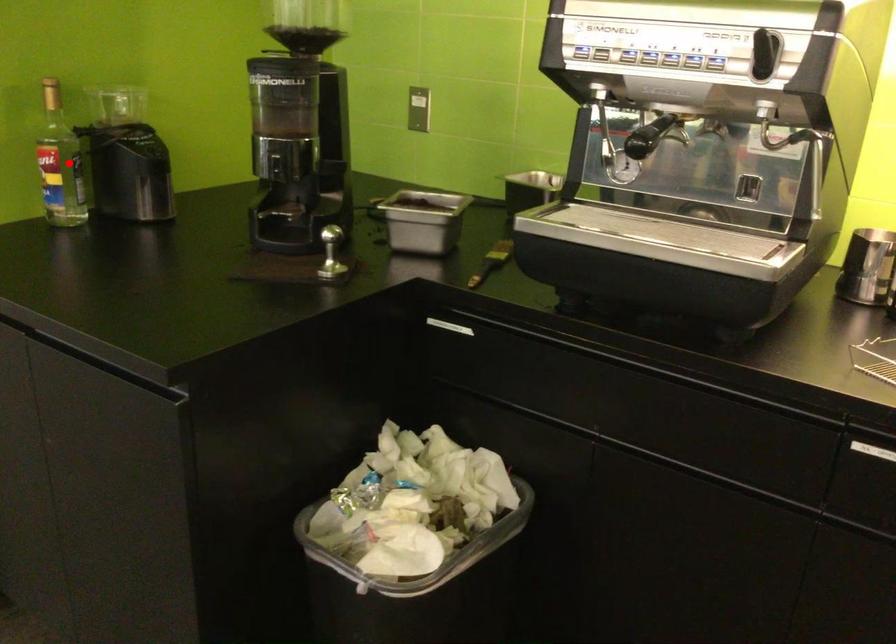
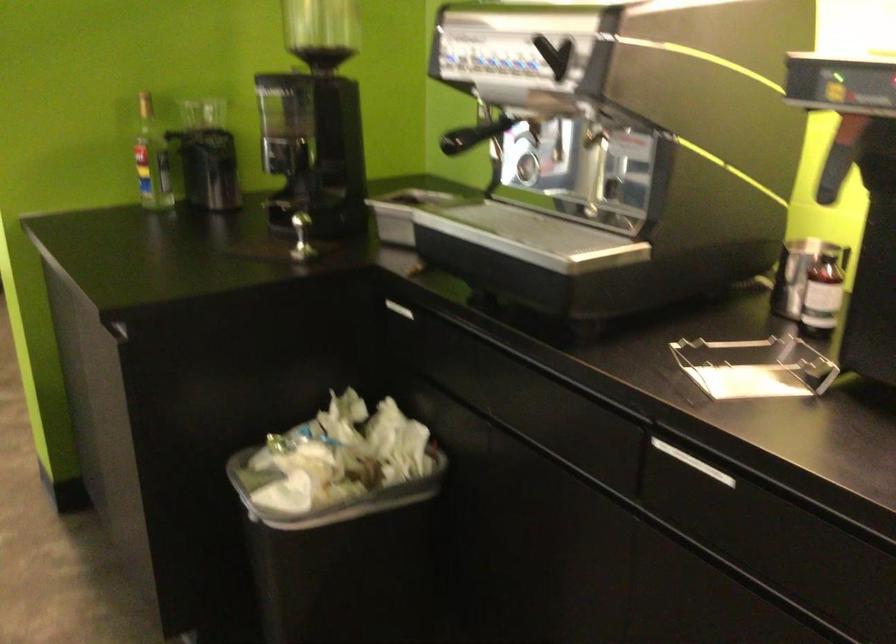
In the second image, find the point that corresponds to the highlighted location in the first image.

(151, 158)